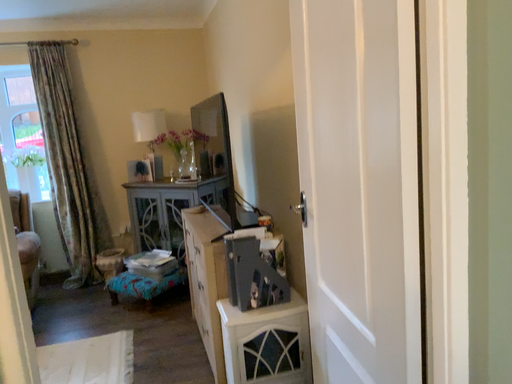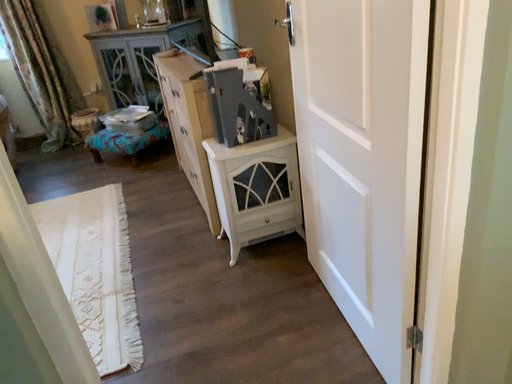
Question: Which way did the camera rotate in the video?

Choices:
 (A) rotated downward
 (B) rotated upward

Answer: (A)